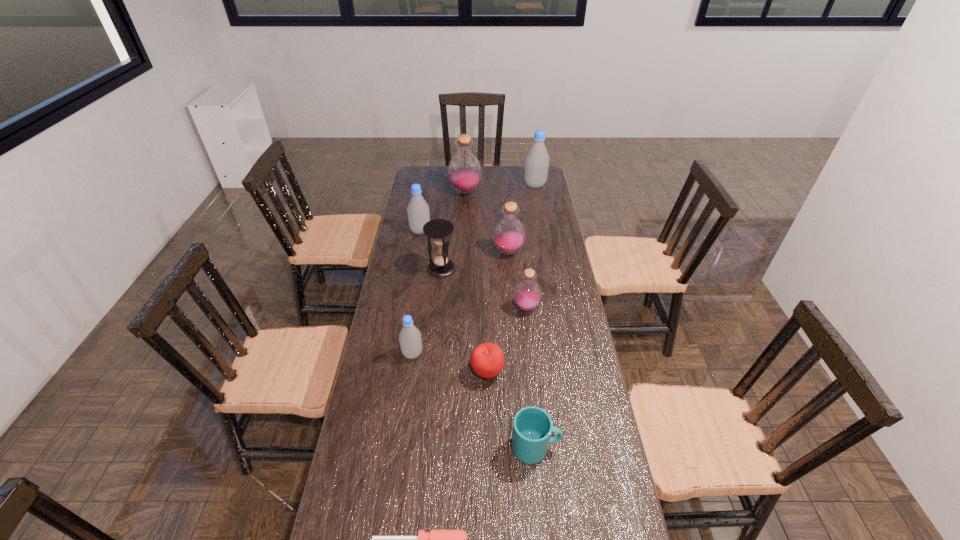
This screenshot has height=540, width=960. What are the coordinates of `the third bottle from left to right` in the screenshot? It's located at (464, 170).

Where is `the farthest purple bottle`? This screenshot has height=540, width=960. the farthest purple bottle is located at coordinates coord(464,170).

Find the location of a particular element. This screenshot has width=960, height=540. the rightmost object is located at coordinates (537, 159).

Where is `the biggest gray bottle`? Image resolution: width=960 pixels, height=540 pixels. the biggest gray bottle is located at coordinates (537, 159).

Where is `the second smallest purple bottle`? Image resolution: width=960 pixels, height=540 pixels. the second smallest purple bottle is located at coordinates (509, 234).

The width and height of the screenshot is (960, 540). What are the coordinates of `the third nearest bottle` in the screenshot? It's located at click(509, 234).

Where is `the third farthest object`? the third farthest object is located at coordinates (418, 212).

You are a GUI agent. You are given a task and a screenshot of the screen. Output one action in this format:
    pyautogui.click(x=<x>, y=<y>)
    Task: Click on the fourth nearest bottle
    
    Given the screenshot: What is the action you would take?
    pyautogui.click(x=418, y=212)

Find the location of `hourglass`. hourglass is located at coordinates (438, 230).

Find the location of a particular element. the nearest gray bottle is located at coordinates (410, 340).